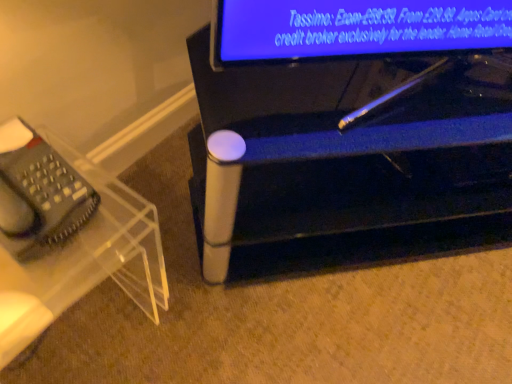
Locate an element on the screen. This screenshot has width=512, height=384. vacant space to the right of transparent acrylic phone stand at left, the 1th furniture in the left-to-right sequence is located at coordinates (214, 326).